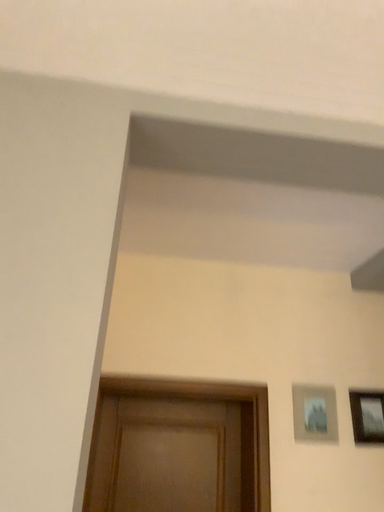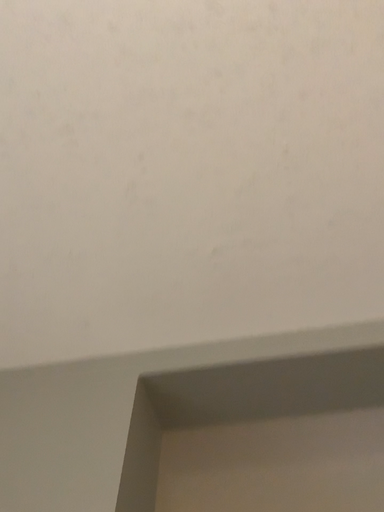
Question: How did the camera likely rotate when shooting the video?

Choices:
 (A) rotated left
 (B) rotated right

Answer: (A)